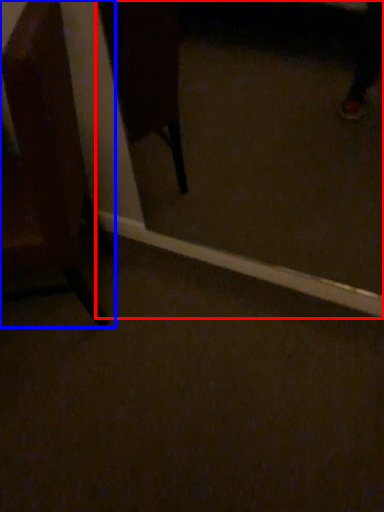
Question: Which object is further to the camera taking this photo, glass door (highlighted by a red box) or chair (highlighted by a blue box)?

Choices:
 (A) glass door
 (B) chair

Answer: (A)